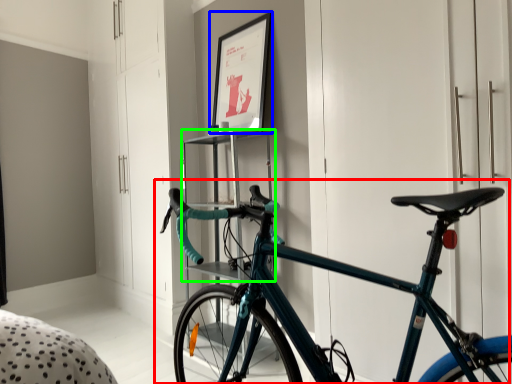
Question: Based on their relative distances, which object is nearer to bicycle (highlighted by a red box)? Choose from picture frame (highlighted by a blue box) and shelf (highlighted by a green box).

Choices:
 (A) picture frame
 (B) shelf

Answer: (B)